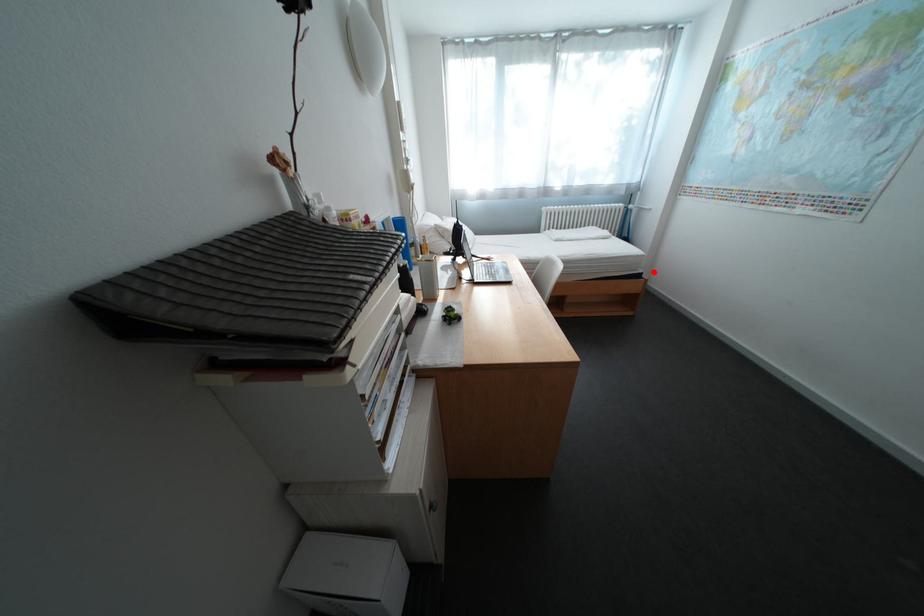
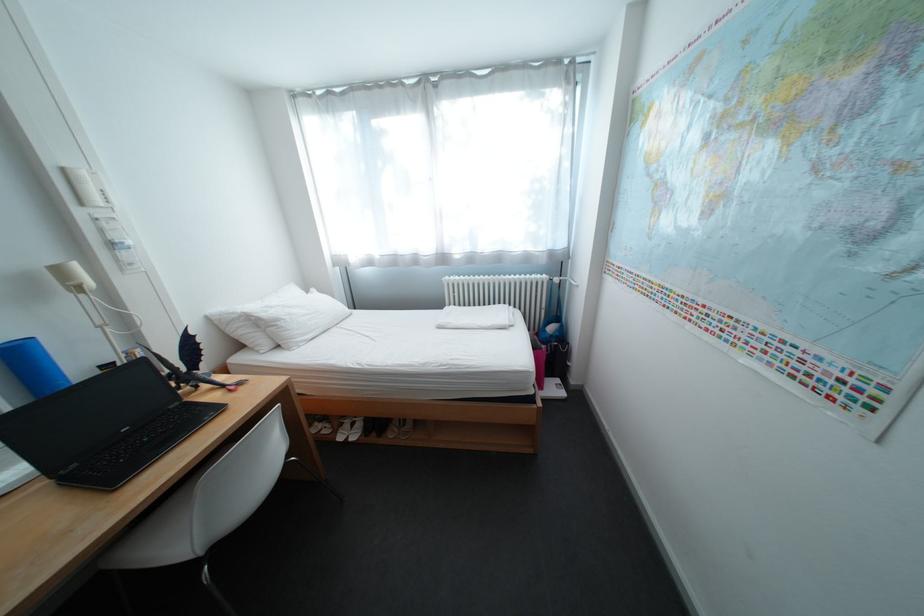
Question: I am providing you with two images of the same scene from different viewpoints. A red point is shown in image1. For the corresponding object point in image2, is it positioned nearer or farther from the camera?

Choices:
 (A) Nearer
 (B) Farther

Answer: (B)